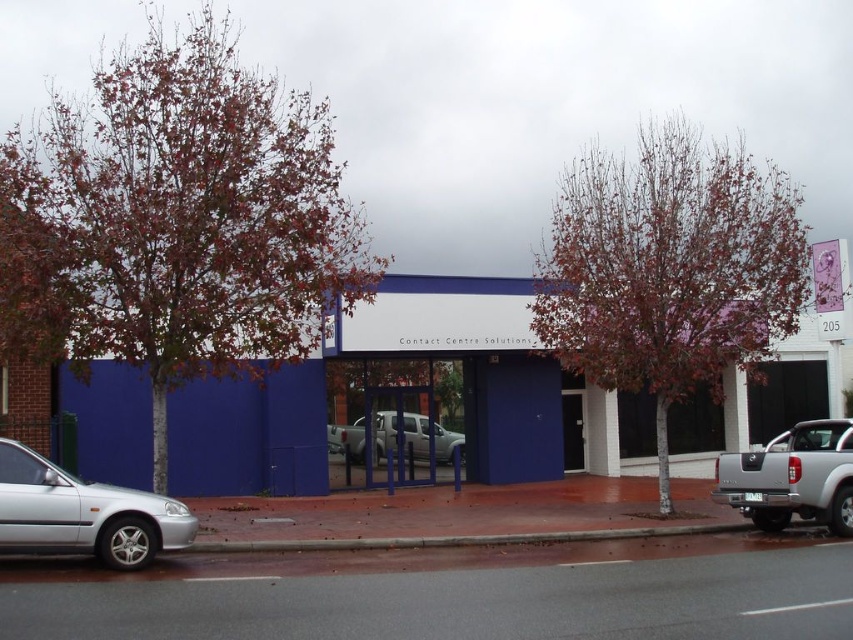
You are a delivery person trying to park a van that is 2 meters wide. You see the silver metallic car at lower left and the silver metallic pickup truck at center parked on the sidewalk. Can your van fit in the space between them?

The silver metallic car at lower left is wider than the silver metallic pickup truck at center. However, the exact width of the space between them isn not provided, so it is uncertain if the van can fit.

You are a delivery person standing at the point marked by the coordinate point at (793, 224). You need to deliver a package to the entrance of the building. The entrance is located between the two parked vehicles. Can you pass through the gap between the two vehicles to reach the entrance?

The two vehicles are 15.93 meters apart, so yes, you can pass through the gap between them to reach the entrance since the distance is sufficient for a person to walk through.